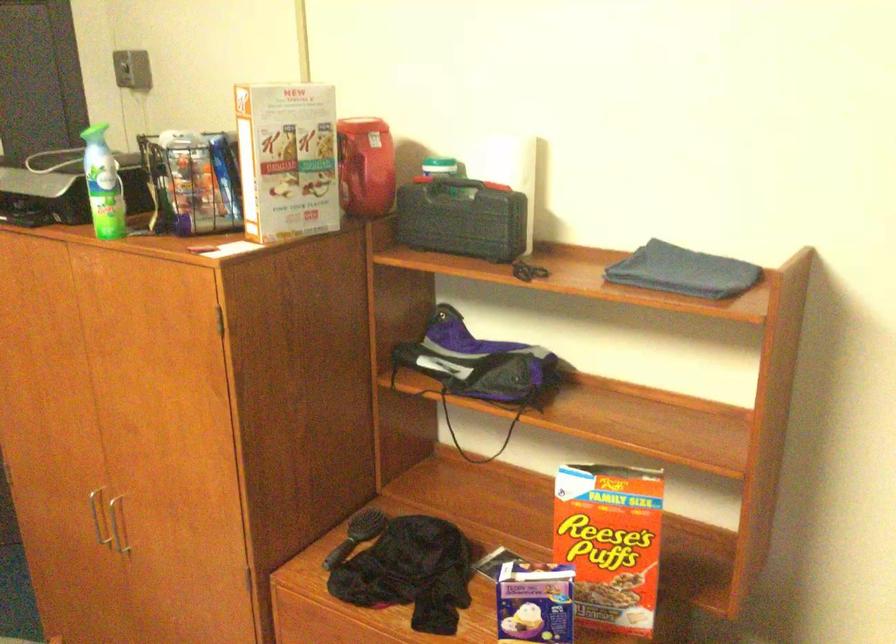
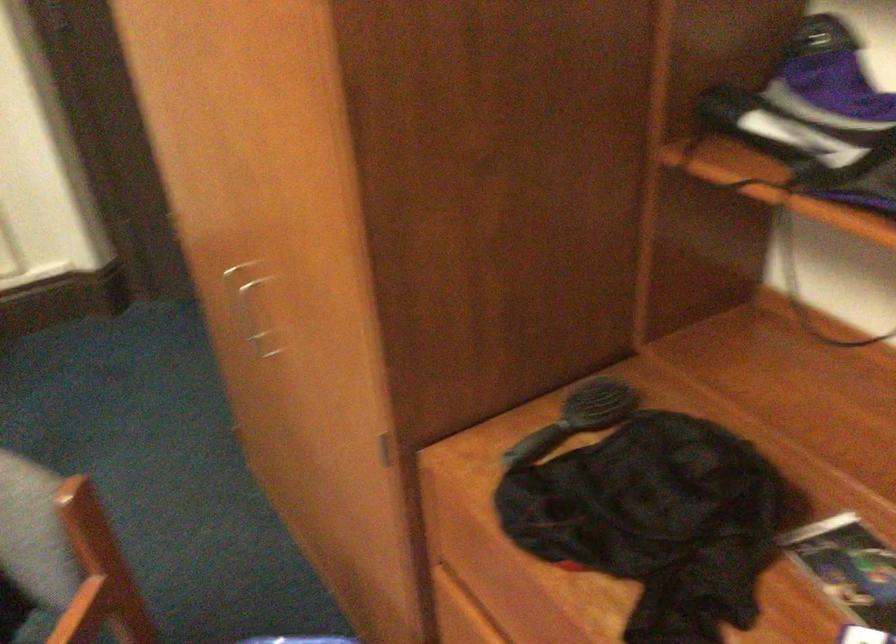
Question: In a continuous first-person perspective shot, in which direction is the camera moving?

Choices:
 (A) Left
 (B) Right
 (C) Forward
 (D) Backward

Answer: (C)